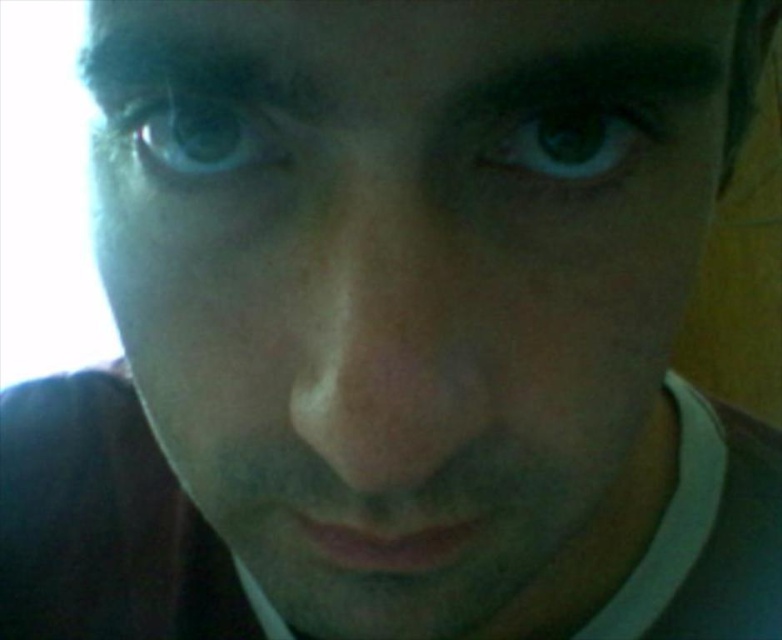
You are holding a smartphone camera and want to take a selfie. You notice a point at coordinates point (499, 141) in the frame that you want to focus on. Considering the distance between this point and your face, can you estimate whether you need to move closer or farther away from the camera to ensure this point is in focus?

The distance between point (499, 141) and the viewer is 8.61 inches. To ensure this point is in focus, you should maintain your current distance of 8.61 inches from the camera.

You are a photographer analyzing this selfie. You notice two eyes in the image. The brown matte eye at center and the blue iridescent eye at upper left. Which eye has a greater width?

The brown matte eye at center has a greater width than the blue iridescent eye at upper left according to the description.

From the picture: You are a photographer analyzing this selfie. You notice two eyes in the image. The brown matte eye at center and the blue iridescent eye at upper left. Which eye is positioned more to the right side of the frame?

The brown matte eye at center is positioned more to the right side of the frame compared to the blue iridescent eye at upper left.